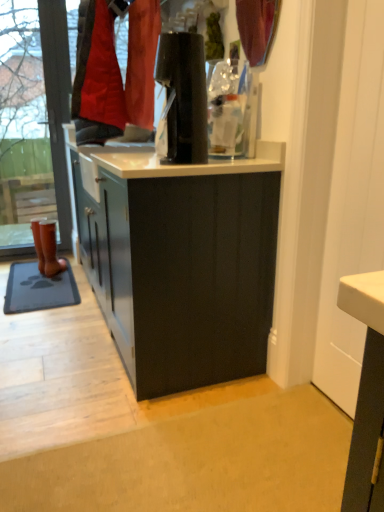
Question: Is gray rubber mat at lower left at the left side of matte red curtain at upper center?

Choices:
 (A) no
 (B) yes

Answer: (B)

Question: From the image's perspective, is gray rubber mat at lower left on matte red curtain at upper center?

Choices:
 (A) yes
 (B) no

Answer: (B)

Question: Is gray rubber mat at lower left far from matte red curtain at upper center?

Choices:
 (A) yes
 (B) no

Answer: (A)

Question: Can you confirm if gray rubber mat at lower left is shorter than matte red curtain at upper center?

Choices:
 (A) no
 (B) yes

Answer: (B)

Question: From the image's perspective, is gray rubber mat at lower left under matte red curtain at upper center?

Choices:
 (A) yes
 (B) no

Answer: (A)

Question: From a real-world perspective, is gray rubber mat at lower left positioned above or below transparent glass shop window at left?

Choices:
 (A) above
 (B) below

Answer: (B)

Question: From the image's perspective, is gray rubber mat at lower left above or below transparent glass shop window at left?

Choices:
 (A) above
 (B) below

Answer: (B)

Question: Considering the relative positions of gray rubber mat at lower left and transparent glass shop window at left in the image provided, is gray rubber mat at lower left to the left or to the right of transparent glass shop window at left?

Choices:
 (A) right
 (B) left

Answer: (A)

Question: Looking at their shapes, would you say gray rubber mat at lower left is wider or thinner than transparent glass shop window at left?

Choices:
 (A) thin
 (B) wide

Answer: (B)

Question: From the image's perspective, relative to brown leather boot at left, is matte red curtain at upper center above or below?

Choices:
 (A) above
 (B) below

Answer: (A)

Question: Is matte red curtain at upper center taller or shorter than brown leather boot at left?

Choices:
 (A) tall
 (B) short

Answer: (B)

Question: Is matte red curtain at upper center inside or outside of brown leather boot at left?

Choices:
 (A) inside
 (B) outside

Answer: (B)

Question: Considering the positions of point (268, 19) and point (44, 243), is point (268, 19) closer or farther from the camera than point (44, 243)?

Choices:
 (A) closer
 (B) farther

Answer: (A)

Question: Considering the positions of brown leather boot at left and matte red curtain at upper center in the image, is brown leather boot at left wider or thinner than matte red curtain at upper center?

Choices:
 (A) thin
 (B) wide

Answer: (B)

Question: From the image's perspective, is brown leather boot at left positioned above or below matte red curtain at upper center?

Choices:
 (A) below
 (B) above

Answer: (A)